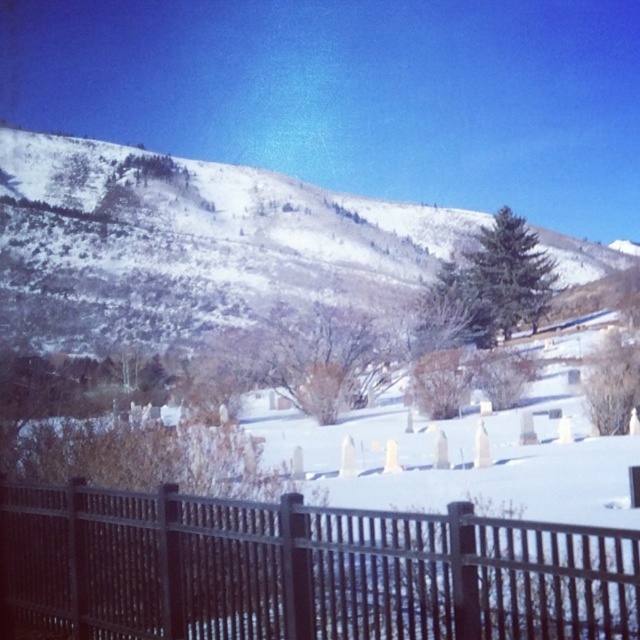
Question: Is black metal fence at lower center above snowy textured hillside at upper center?

Choices:
 (A) no
 (B) yes

Answer: (A)

Question: Which point appears farthest from the camera in this image?

Choices:
 (A) (179, 330)
 (B) (410, 516)

Answer: (A)

Question: Does black metal fence at lower center have a larger size compared to snowy textured hillside at upper center?

Choices:
 (A) no
 (B) yes

Answer: (A)

Question: Does black metal fence at lower center appear over snowy textured hillside at upper center?

Choices:
 (A) no
 (B) yes

Answer: (A)